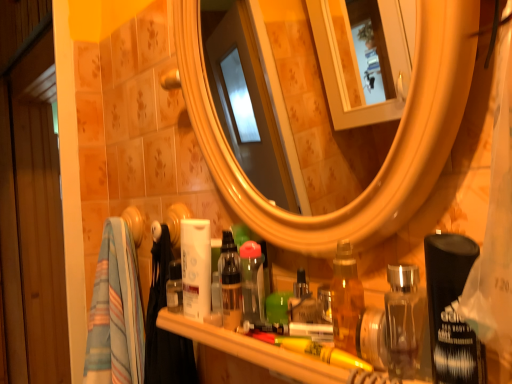
Describe the element at coordinates (231, 295) in the screenshot. The width and height of the screenshot is (512, 384). I see `translucent plastic bottle at center, arranged as the 1th toiletry when viewed from the left` at that location.

At what (x,y) coordinates should I click in order to perform the action: click on clear plastic bottle at center, the 2th toiletry when ordered from right to left. Please return your answer as a coordinate pair (x, y). The height and width of the screenshot is (384, 512). Looking at the image, I should click on (252, 282).

This screenshot has width=512, height=384. What do you see at coordinates (252, 282) in the screenshot? I see `clear plastic bottle at center, the 2th toiletry when ordered from right to left` at bounding box center [252, 282].

Find the location of a particular element. green plastic brush at center, the third toiletry positioned from the left is located at coordinates (277, 307).

The height and width of the screenshot is (384, 512). Find the location of `translucent plastic bottle at center, arranged as the 1th toiletry when viewed from the left`. translucent plastic bottle at center, arranged as the 1th toiletry when viewed from the left is located at coordinates (231, 295).

How different are the orientations of translucent plastic bottle at center, which appears as the third toiletry when viewed from the right, and translucent plastic items at lower center in degrees?

There is a 1.42-degree angle between the facing directions of translucent plastic bottle at center, which appears as the third toiletry when viewed from the right, and translucent plastic items at lower center.

Does translucent plastic bottle at center, which appears as the third toiletry when viewed from the right, contain translucent plastic items at lower center?

No.

Considering the sizes of objects translucent plastic bottle at center, arranged as the 1th toiletry when viewed from the left, and translucent plastic items at lower center in the image provided, who is smaller, translucent plastic bottle at center, arranged as the 1th toiletry when viewed from the left, or translucent plastic items at lower center?

Smaller between the two is translucent plastic bottle at center, arranged as the 1th toiletry when viewed from the left.

Looking at this image, which of these two, translucent plastic bottle at center, arranged as the 1th toiletry when viewed from the left, or translucent plastic items at lower center, is wider?

translucent plastic items at lower center is wider.

Which object is closer to the camera, translucent plastic items at lower center or green plastic brush at center, which is the 1th toiletry in right-to-left order?

translucent plastic items at lower center is more forward.

From the image's perspective, which object appears higher, translucent plastic items at lower center or green plastic brush at center, which is the 1th toiletry in right-to-left order?

From the image's view, green plastic brush at center, which is the 1th toiletry in right-to-left order, is above.

Measure the distance from green plastic brush at center, which is the 1th toiletry in right-to-left order, to translucent plastic items at lower center.

4.41 inches.

In the scene shown: Can you confirm if green plastic brush at center, which is the 1th toiletry in right-to-left order, is bigger than translucent plastic items at lower center?

No, green plastic brush at center, which is the 1th toiletry in right-to-left order, is not bigger than translucent plastic items at lower center.

Is green plastic brush at center, which is the 1th toiletry in right-to-left order, further to the viewer compared to translucent plastic items at lower center?

Yes, green plastic brush at center, which is the 1th toiletry in right-to-left order, is further from the viewer.

Are green plastic brush at center, which is the 1th toiletry in right-to-left order, and translucent plastic items at lower center located far from each other?

No, green plastic brush at center, which is the 1th toiletry in right-to-left order, is in close proximity to translucent plastic items at lower center.

Consider the image. From the image's perspective, is translucent plastic items at lower center located above translucent plastic bottle at center, which appears as the third toiletry when viewed from the right?

No.

Does point (289, 372) lie behind point (238, 270)?

No.

Which of these two, translucent plastic items at lower center or translucent plastic bottle at center, arranged as the 1th toiletry when viewed from the left, is wider?

With larger width is translucent plastic items at lower center.

Could you tell me if translucent plastic items at lower center is turned towards translucent plastic bottle at center, which appears as the third toiletry when viewed from the right?

No, translucent plastic items at lower center is not turned towards translucent plastic bottle at center, which appears as the third toiletry when viewed from the right.

Which is behind, point (284, 295) or point (243, 281)?

Point (243, 281)

Can you see green plastic brush at center, the third toiletry positioned from the left, touching clear plastic bottle at center, the 2th toiletry when ordered from right to left?

Yes, green plastic brush at center, the third toiletry positioned from the left, and clear plastic bottle at center, the 2th toiletry when ordered from right to left, clearly make contact.

From a real-world perspective, is green plastic brush at center, which is the 1th toiletry in right-to-left order, positioned under clear plastic bottle at center, the 2th toiletry when ordered from right to left, based on gravity?

Yes, from a real-world perspective, green plastic brush at center, which is the 1th toiletry in right-to-left order, is beneath clear plastic bottle at center, the 2th toiletry when ordered from right to left.

Is green plastic brush at center, the third toiletry positioned from the left, oriented towards clear plastic bottle at center, the 2th toiletry when ordered from right to left?

No, green plastic brush at center, the third toiletry positioned from the left, is not turned towards clear plastic bottle at center, the 2th toiletry when ordered from right to left.

This screenshot has height=384, width=512. Find the location of `the 2nd toiletry counting from the left of the translucent plastic items at lower center`. the 2nd toiletry counting from the left of the translucent plastic items at lower center is located at coordinates (252, 282).

In the scene shown: Are translucent plastic items at lower center and clear plastic bottle at center, the 2th toiletry when ordered from right to left, far apart?

They are positioned close to each other.

Is translucent plastic items at lower center positioned beyond the bounds of clear plastic bottle at center, the 2th toiletry when ordered from right to left?

Yes, translucent plastic items at lower center is not within clear plastic bottle at center, the 2th toiletry when ordered from right to left.

From the image's perspective, is clear plastic bottle at center, the 2th toiletry when ordered from right to left, under translucent plastic items at lower center?

No, from the image's perspective, clear plastic bottle at center, the 2th toiletry when ordered from right to left, is not beneath translucent plastic items at lower center.

Are clear plastic bottle at center, the 2th toiletry when ordered from right to left, and translucent plastic items at lower center making contact?

No, clear plastic bottle at center, the 2th toiletry when ordered from right to left, is not beside translucent plastic items at lower center.

Choose the correct answer: Is clear plastic bottle at center, which appears as the 2th toiletry when viewed from the left, inside translucent plastic items at lower center or outside it?

clear plastic bottle at center, which appears as the 2th toiletry when viewed from the left, cannot be found inside translucent plastic items at lower center.

From a real-world perspective, is clear plastic bottle at center, which appears as the 2th toiletry when viewed from the left, on translucent plastic items at lower center?

Correct, in the physical world, clear plastic bottle at center, which appears as the 2th toiletry when viewed from the left, is higher than translucent plastic items at lower center.

I want to click on the 3rd toiletry to the left when counting from the translucent plastic items at lower center, so click(x=231, y=295).

Locate an element on the screen. the 1st toiletry above the translucent plastic items at lower center (from the image's perspective) is located at coordinates (277, 307).

Estimate the real-world distances between objects in this image. Which object is further from green plastic brush at center, which is the 1th toiletry in right-to-left order, translucent plastic items at lower center or clear plastic bottle at center, which appears as the 2th toiletry when viewed from the left?

Among the two, translucent plastic items at lower center is located further to green plastic brush at center, which is the 1th toiletry in right-to-left order.

From the image, which object appears to be nearer to green plastic brush at center, which is the 1th toiletry in right-to-left order, clear plastic bottle at center, the 2th toiletry when ordered from right to left, or translucent plastic bottle at center, arranged as the 1th toiletry when viewed from the left?

Among the two, clear plastic bottle at center, the 2th toiletry when ordered from right to left, is located nearer to green plastic brush at center, which is the 1th toiletry in right-to-left order.

Which object lies further to the anchor point translucent plastic items at lower center, clear plastic bottle at center, the 2th toiletry when ordered from right to left, or translucent plastic bottle at center, which appears as the third toiletry when viewed from the right?

Based on the image, clear plastic bottle at center, the 2th toiletry when ordered from right to left, appears to be further to translucent plastic items at lower center.

Based on the photo, looking at the image, which one is located further to translucent plastic bottle at center, which appears as the third toiletry when viewed from the right, clear plastic bottle at center, the 2th toiletry when ordered from right to left, or translucent plastic items at lower center?

translucent plastic items at lower center lies further to translucent plastic bottle at center, which appears as the third toiletry when viewed from the right, than the other object.

Looking at the image, which one is located closer to clear plastic bottle at center, which appears as the 2th toiletry when viewed from the left, translucent plastic items at lower center or translucent plastic bottle at center, arranged as the 1th toiletry when viewed from the left?

translucent plastic bottle at center, arranged as the 1th toiletry when viewed from the left, is closer to clear plastic bottle at center, which appears as the 2th toiletry when viewed from the left.

Estimate the real-world distances between objects in this image. Which object is closer to green plastic brush at center, the third toiletry positioned from the left, translucent plastic bottle at center, which appears as the third toiletry when viewed from the right, or clear plastic bottle at center, the 2th toiletry when ordered from right to left?

clear plastic bottle at center, the 2th toiletry when ordered from right to left.

Estimate the real-world distances between objects in this image. Which object is closer to translucent plastic bottle at center, arranged as the 1th toiletry when viewed from the left, translucent plastic items at lower center or green plastic brush at center, which is the 1th toiletry in right-to-left order?

green plastic brush at center, which is the 1th toiletry in right-to-left order, is closer to translucent plastic bottle at center, arranged as the 1th toiletry when viewed from the left.

Which object lies further to the anchor point translucent plastic items at lower center, green plastic brush at center, which is the 1th toiletry in right-to-left order, or clear plastic bottle at center, which appears as the 2th toiletry when viewed from the left?

Based on the image, green plastic brush at center, which is the 1th toiletry in right-to-left order, appears to be further to translucent plastic items at lower center.

This screenshot has width=512, height=384. Identify the location of toiletry situated between translucent plastic bottle at center, which appears as the third toiletry when viewed from the right, and green plastic brush at center, which is the 1th toiletry in right-to-left order, from left to right. pyautogui.click(x=252, y=282).

Locate an element on the screen. toiletry between translucent plastic items at lower center and translucent plastic bottle at center, which appears as the third toiletry when viewed from the right, from front to back is located at coordinates (277, 307).